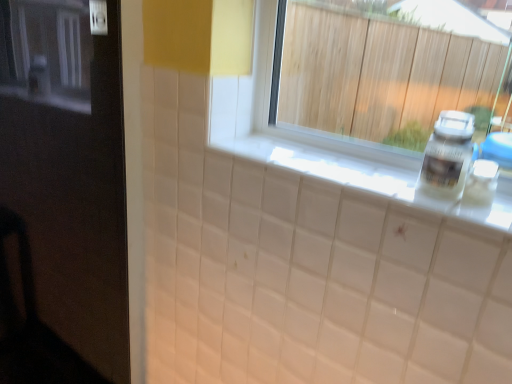
Question: In the image, is black glossy door at left positioned in front of or behind white glossy counter top at center?

Choices:
 (A) front
 (B) behind

Answer: (A)

Question: Visually, is black glossy door at left positioned to the left or to the right of white glossy counter top at center?

Choices:
 (A) left
 (B) right

Answer: (A)

Question: Considering the real-world distances, which object is closest to the black glossy door at left?

Choices:
 (A) white plastic bottle at right
 (B) white glossy counter top at center

Answer: (B)

Question: Which object is the closest to the white glossy counter top at center?

Choices:
 (A) black glossy door at left
 (B) white plastic bottle at right

Answer: (A)